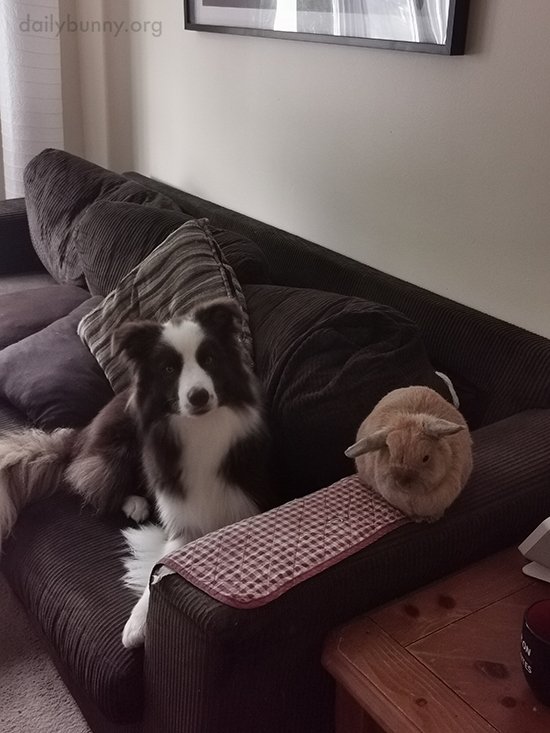
Where is `wall`? Image resolution: width=550 pixels, height=733 pixels. wall is located at coordinates (428, 144).